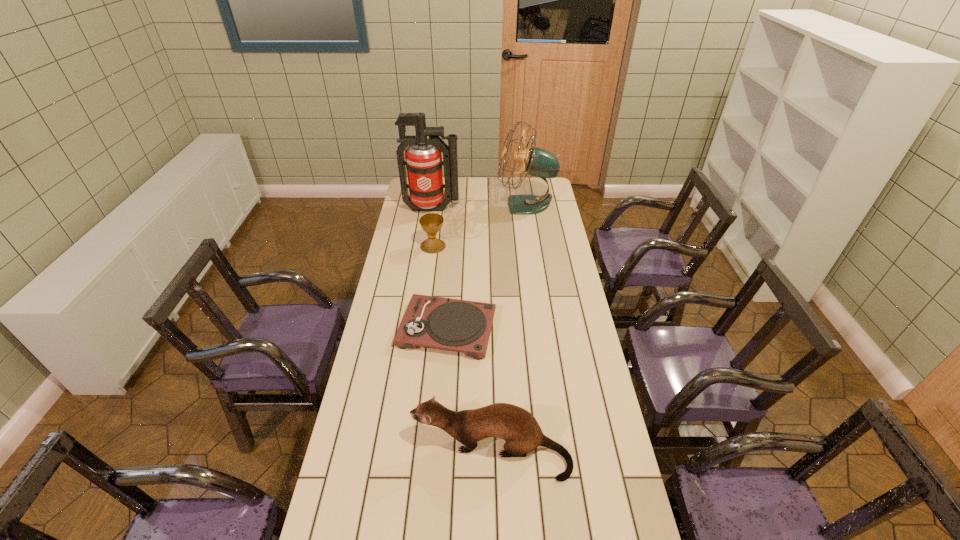
This screenshot has width=960, height=540. I want to click on free spot located 0.160m on the front-facing side of the fan for air flow, so click(x=467, y=205).

This screenshot has width=960, height=540. Identify the location of vacant space located 0.100m on the front-facing side of the fan for air flow. (478, 205).

Where is `free space located 0.160m at the face of the nearest object`? The width and height of the screenshot is (960, 540). free space located 0.160m at the face of the nearest object is located at coordinates (357, 451).

You are a GUI agent. You are given a task and a screenshot of the screen. Output one action in this format:
    pyautogui.click(x=<x>, y=<y>)
    Task: Click on the free space located at the face of the nearest object
    This screenshot has height=540, width=960.
    Given the screenshot: What is the action you would take?
    pyautogui.click(x=385, y=451)

What are the coordinates of `vacant space located at the face of the nearest object` in the screenshot? It's located at (381, 451).

Locate an element on the screen. Image resolution: width=960 pixels, height=540 pixels. vacant region located on the front of the chalice is located at coordinates (426, 300).

What are the coordinates of `free space located on the back of the shortest object` in the screenshot? It's located at (454, 241).

At what (x,y) coordinates should I click in order to perform the action: click on object situated at the far edge. Please return your answer as a coordinate pair (x, y). Looking at the image, I should click on (538, 162).

Identify the location of fire extinguisher that is at the left edge. This screenshot has width=960, height=540. (423, 157).

Where is `chalice located at the left edge`? The height and width of the screenshot is (540, 960). chalice located at the left edge is located at coordinates (431, 223).